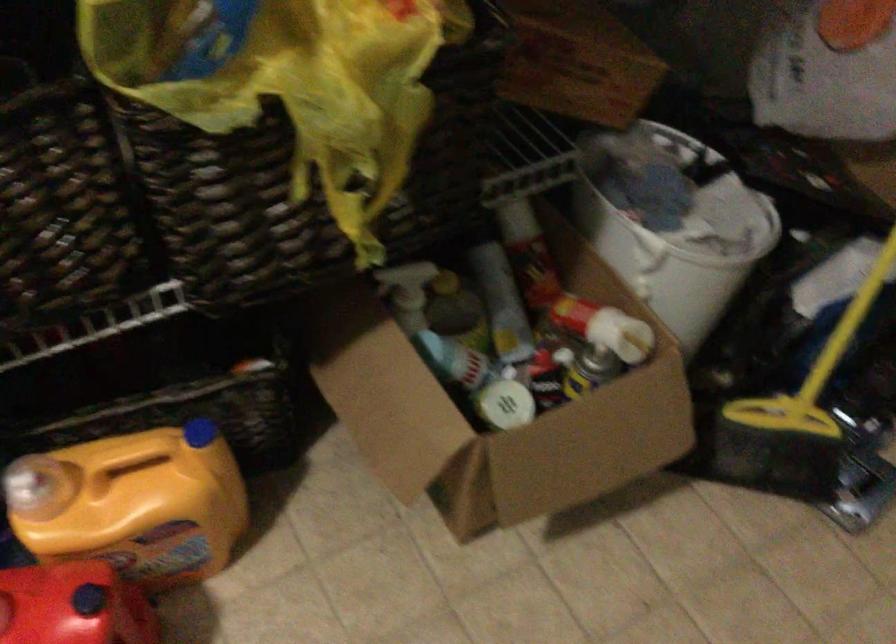
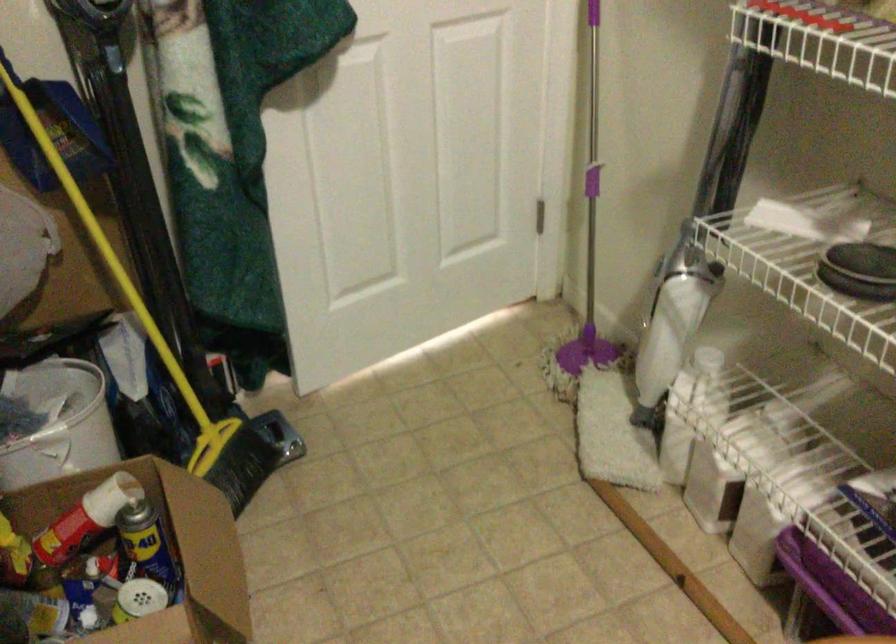
Where in the second image is the point corresponding to (584,319) from the first image?

(85, 518)